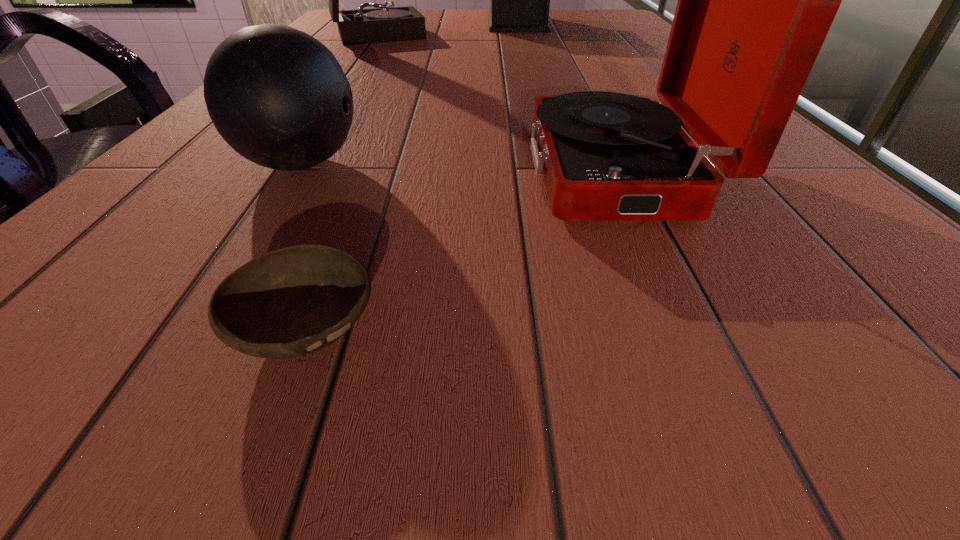
At what (x,y) coordinates should I click in order to perform the action: click on free point between the bowl and the tallest object. Please return your answer as a coordinate pair (x, y). This screenshot has height=540, width=960. Looking at the image, I should click on (412, 176).

You are a GUI agent. You are given a task and a screenshot of the screen. Output one action in this format:
    pyautogui.click(x=<x>, y=<y>)
    Task: Click on the object that can be found as the closest to the nearest phonograph_record
    The height and width of the screenshot is (540, 960).
    Given the screenshot: What is the action you would take?
    (x=290, y=302)

Locate an element on the screen. This screenshot has width=960, height=540. object that is the fourth closest to the leftmost phonograph_record is located at coordinates (290, 302).

Identify which phonograph_record is the nearest to the fourth tallest object. Please provide its 2D coordinates. Your answer should be formatted as a tuple, i.e. [(x, y)], where the tuple contains the x and y coordinates of a point satisfying the conditions above.

[(756, 0)]

I want to click on the closest phonograph_record to the tallest object, so click(362, 26).

You are a GUI agent. You are given a task and a screenshot of the screen. Output one action in this format:
    pyautogui.click(x=<x>, y=<y>)
    Task: Click on the vacant space that satisfies the following two spatial constraints: 1. at the horn opening of the tallest object; 2. on the front side of the leftmost phonograph_record
    
    Given the screenshot: What is the action you would take?
    pyautogui.click(x=520, y=33)